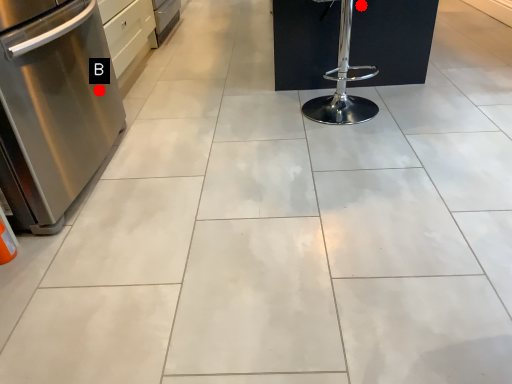
Question: Two points are circled on the image, labeled by A and B beside each circle. Which point appears farthest from the camera in this image?

Choices:
 (A) A is further
 (B) B is further

Answer: (A)